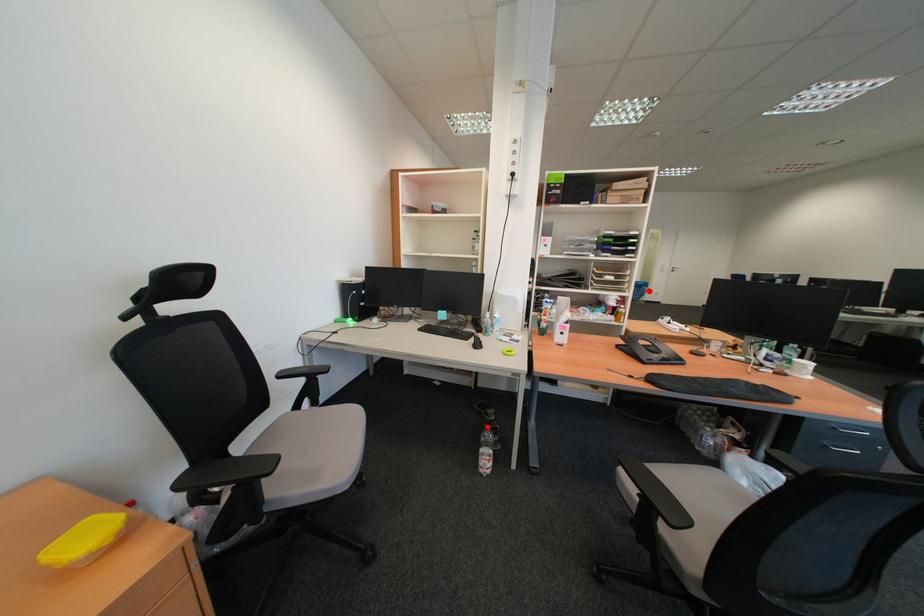
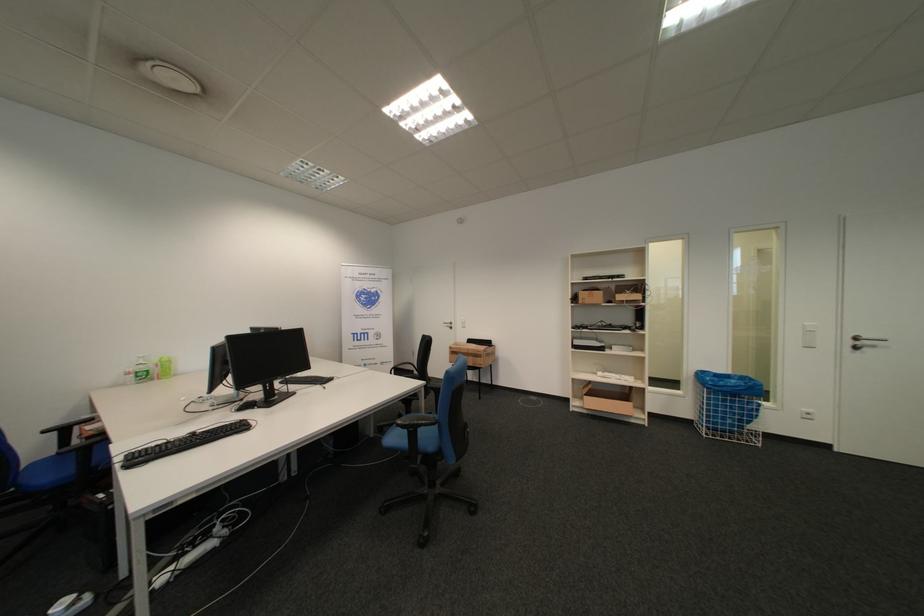
Question: A red point is marked in image1. In image2, is the corresponding 3D point closer to the camera or farther? Reply with the corresponding letter.

Choices:
 (A) The corresponding 3D point is closer.
 (B) The corresponding 3D point is farther.

Answer: (A)